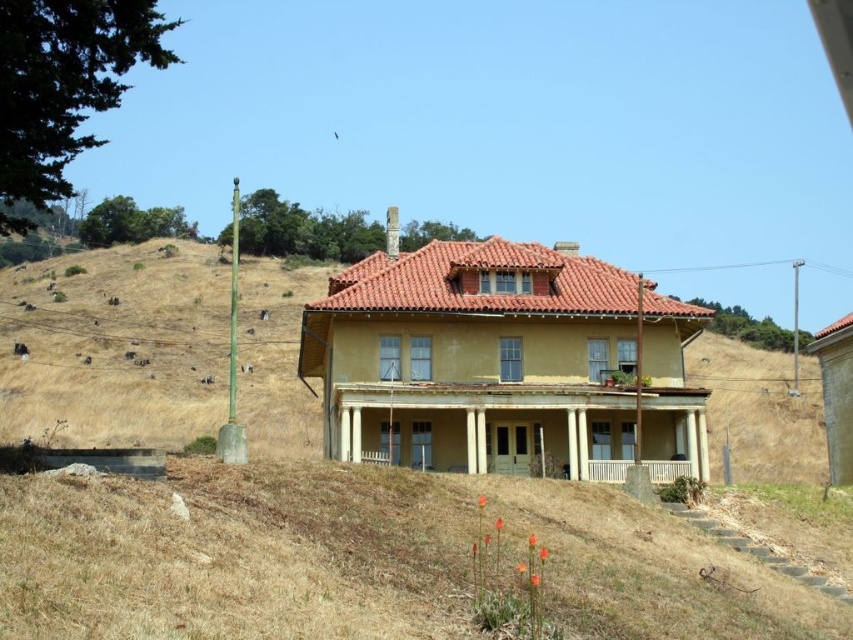
Question: Among these objects, which one is farthest from the camera?

Choices:
 (A) dry grass at center
 (B) dry grass at left
 (C) yellow painted wood porch at center

Answer: (B)

Question: Which point is closer to the camera taking this photo?

Choices:
 (A) (265, 278)
 (B) (3, 589)
 (C) (384, 403)

Answer: (B)

Question: Can you confirm if dry grass at left is bigger than yellow painted wood porch at center?

Choices:
 (A) yes
 (B) no

Answer: (A)

Question: Is dry grass at center below yellow painted wood porch at center?

Choices:
 (A) no
 (B) yes

Answer: (B)

Question: Is the position of dry grass at center less distant than that of dry grass at left?

Choices:
 (A) yes
 (B) no

Answer: (A)

Question: Based on their relative distances, which object is farther from the dry grass at center?

Choices:
 (A) yellow painted wood porch at center
 (B) dry grass at left

Answer: (B)